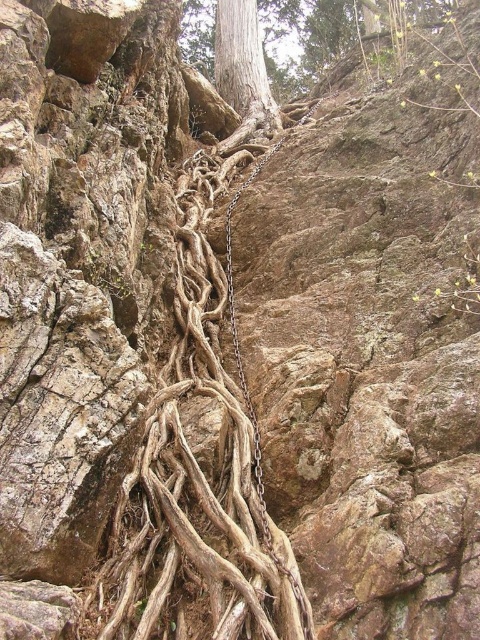
Is point (159, 436) positioned after point (251, 115)?

No, (159, 436) is in front of (251, 115).

Who is positioned more to the left, brown rough tree roots at center or smooth gray tree trunk at upper center?

From the viewer's perspective, brown rough tree roots at center appears more on the left side.

Identify the location of brown rough tree roots at center. This screenshot has width=480, height=640. (197, 477).

Find the location of a particular element. smooth gray tree trunk at upper center is located at coordinates (242, 64).

Can you confirm if smooth gray tree trunk at upper center is smaller than metallic chain at center?

No, smooth gray tree trunk at upper center is not smaller than metallic chain at center.

Describe the element at coordinates (242, 64) in the screenshot. The width and height of the screenshot is (480, 640). I see `smooth gray tree trunk at upper center` at that location.

Locate an element on the screen. Image resolution: width=480 pixels, height=640 pixels. smooth gray tree trunk at upper center is located at coordinates (242, 64).

Can you confirm if brown rough tree roots at center is shorter than metallic chain at center?

Indeed, brown rough tree roots at center has a lesser height compared to metallic chain at center.

Does brown rough tree roots at center have a smaller size compared to metallic chain at center?

Yes, brown rough tree roots at center is smaller than metallic chain at center.

Is point (204, 593) closer to viewer compared to point (228, 285)?

Yes, point (204, 593) is closer to viewer.

In order to click on brown rough tree roots at center in this screenshot , I will do `click(197, 477)`.